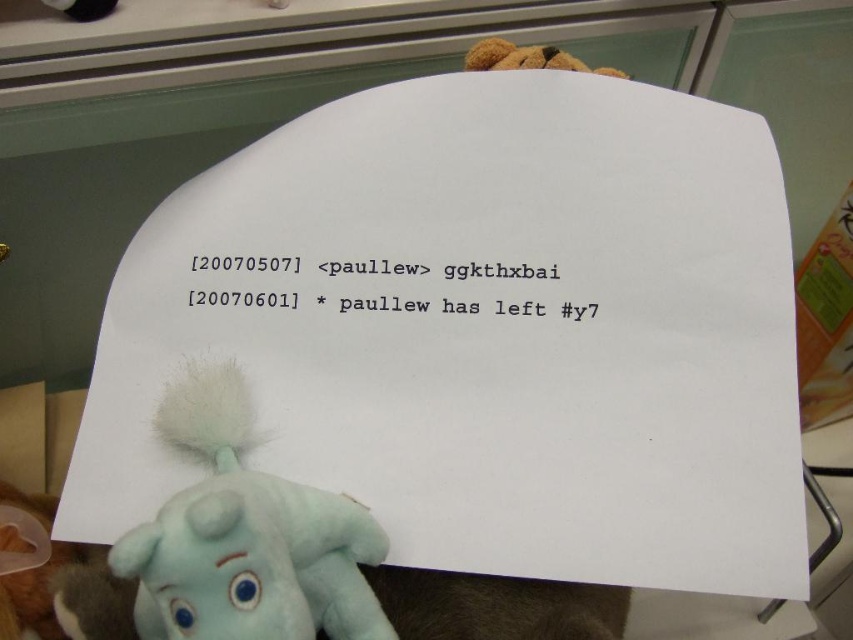
Question: Based on their relative distances, which object is farther from the blacktextured papernote at upper center?

Choices:
 (A) blue plush toy at lower left
 (B) brown plush bear at upper center

Answer: (B)

Question: Which point is closer to the camera?

Choices:
 (A) (491, 67)
 (B) (535, 305)

Answer: (B)

Question: Can you confirm if blue plush toy at lower left is bigger than blacktextured papernote at upper center?

Choices:
 (A) yes
 (B) no

Answer: (A)

Question: Where is blacktextured papernote at upper center located in relation to brown plush bear at upper center in the image?

Choices:
 (A) below
 (B) above

Answer: (A)

Question: Observing the image, what is the correct spatial positioning of blue plush toy at lower left in reference to brown plush bear at upper center?

Choices:
 (A) below
 (B) above

Answer: (A)

Question: Which object is positioned closest to the brown plush bear at upper center?

Choices:
 (A) blue plush toy at lower left
 (B) blacktextured papernote at upper center

Answer: (B)